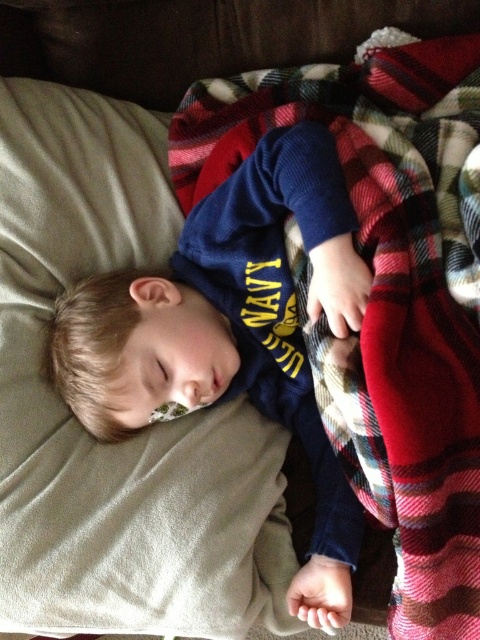
Does plaid fabric blanket at upper right have a lesser height compared to navy blue sweater at center?

No.

Is point (416, 525) farther from viewer compared to point (82, 342)?

No, (416, 525) is closer to viewer.

I want to click on plaid fabric blanket at upper right, so click(387, 291).